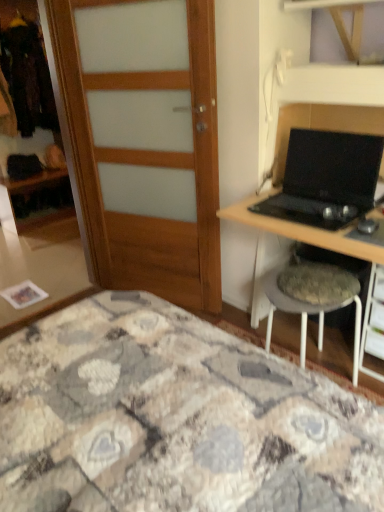
Question: Is matte wood wardrobe at left next to wooden door at left?

Choices:
 (A) yes
 (B) no

Answer: (B)

Question: Considering the relative sizes of matte wood wardrobe at left and wooden door at left in the image provided, is matte wood wardrobe at left thinner than wooden door at left?

Choices:
 (A) yes
 (B) no

Answer: (B)

Question: Does matte wood wardrobe at left lie behind wooden door at left?

Choices:
 (A) yes
 (B) no

Answer: (A)

Question: Is matte wood wardrobe at left far from wooden door at left?

Choices:
 (A) yes
 (B) no

Answer: (A)

Question: From the image's perspective, is matte wood wardrobe at left on top of wooden door at left?

Choices:
 (A) no
 (B) yes

Answer: (B)

Question: Is matte wood wardrobe at left not within wooden door at left?

Choices:
 (A) no
 (B) yes

Answer: (B)

Question: Can you confirm if black matte laptop at right is positioned to the left of textured fabric stool at right?

Choices:
 (A) yes
 (B) no

Answer: (A)

Question: Is black matte laptop at right facing away from textured fabric stool at right?

Choices:
 (A) no
 (B) yes

Answer: (A)

Question: Would you say black matte laptop at right is a long distance from textured fabric stool at right?

Choices:
 (A) no
 (B) yes

Answer: (A)

Question: From the image's perspective, would you say black matte laptop at right is shown under textured fabric stool at right?

Choices:
 (A) no
 (B) yes

Answer: (A)

Question: From the image's perspective, is black matte laptop at right over textured fabric stool at right?

Choices:
 (A) no
 (B) yes

Answer: (B)

Question: Is black matte laptop at right beside textured fabric stool at right?

Choices:
 (A) yes
 (B) no

Answer: (B)

Question: Are wooden door at left and black matte laptop at right located far from each other?

Choices:
 (A) yes
 (B) no

Answer: (B)